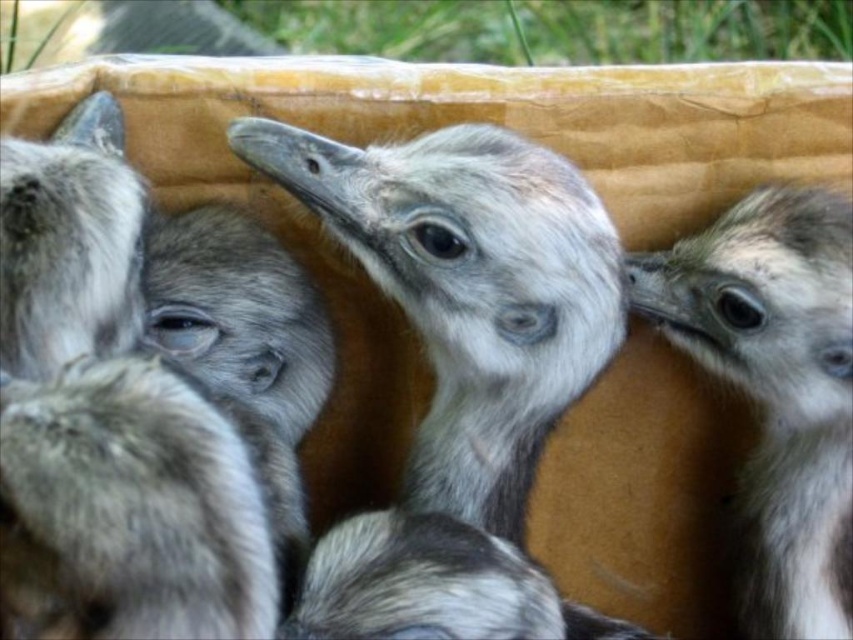
You are a wildlife photographer trying to capture a closeup of both the gray downy ostrich at center and the gray fluffy ostrich at center in the cardboard box. Given that your camera can only focus on objects within a 7 inch range, will you be able to get both in focus?

The gray downy ostrich at center is 6.98 inches from the gray fluffy ostrich at center, which is within the 7 inch range of your camera. Therefore, you can capture both in focus.

You are a wildlife photographer observing a group of young ostriches in a cardboard box. You notice two gray downy ostrich at center and gray fluffy ostrich at center. Which one is located more to the left?

The gray downy ostrich at center is positioned on the left side of gray fluffy ostrich at center, so it is more to the left.